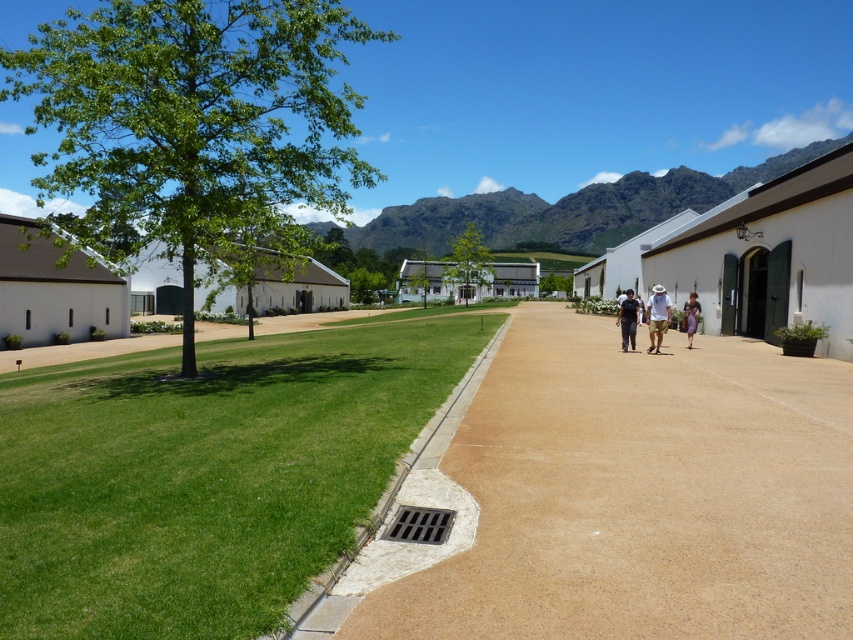
Does beige woven hat at center appear on the right side of dark blue shirt at center?

Correct, you'll find beige woven hat at center to the right of dark blue shirt at center.

Does beige woven hat at center appear over dark blue shirt at center?

No.

This screenshot has height=640, width=853. I want to click on beige woven hat at center, so click(x=657, y=316).

Does point (631, 440) lie behind point (369, 445)?

Yes, it is.

At what (x,y) coordinates should I click in order to perform the action: click on brown concrete path at center. Please return your answer as a coordinate pair (x, y). The width and height of the screenshot is (853, 640). Looking at the image, I should click on (630, 497).

Where is `brown concrete path at center`? brown concrete path at center is located at coordinates (630, 497).

Can you confirm if beige woven hat at center is taller than purple fabric bag at center-right?

No, beige woven hat at center is not taller than purple fabric bag at center-right.

Between point (660, 336) and point (689, 304), which one is positioned in front?

Positioned in front is point (660, 336).

This screenshot has height=640, width=853. I want to click on beige woven hat at center, so click(657, 316).